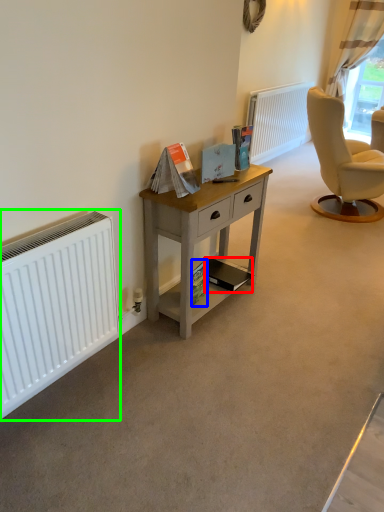
Question: Which is farther away from magazine (highlighted by a red box)? magazine (highlighted by a blue box) or radiator (highlighted by a green box)?

Choices:
 (A) magazine
 (B) radiator

Answer: (B)